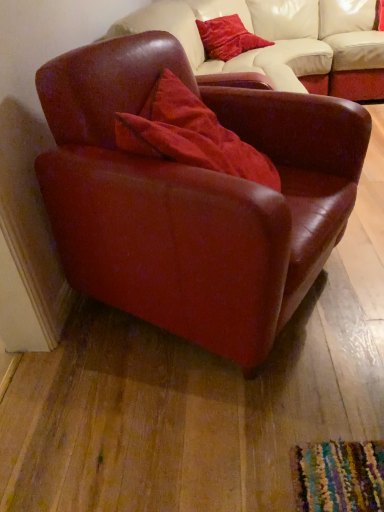
Find the location of a particular element. This screenshot has height=512, width=384. free space on the front side of matte leather armchair at center is located at coordinates (214, 424).